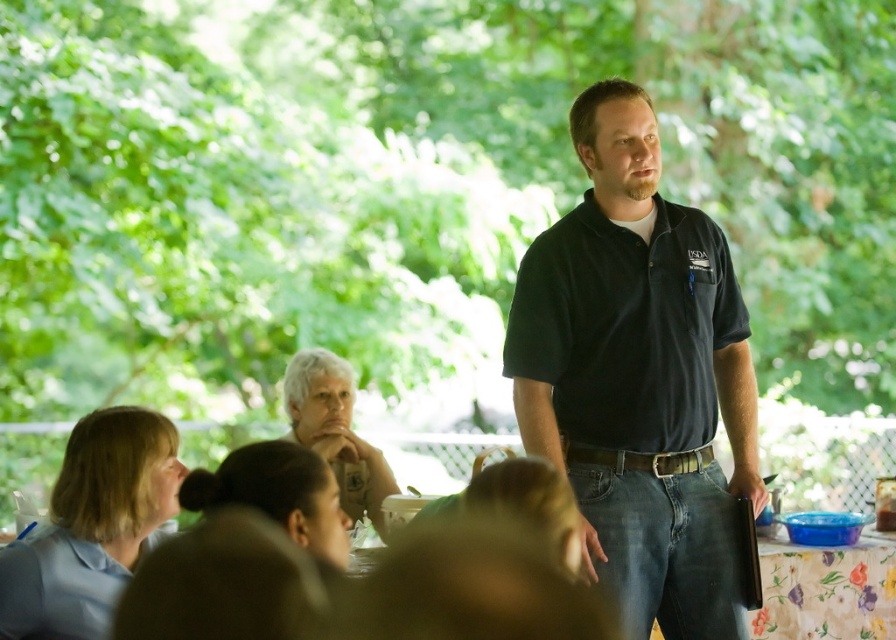
Question: Is dark blue shirt at center bigger than black cotton polo shirt at center?

Choices:
 (A) no
 (B) yes

Answer: (B)

Question: Where is dark blue shirt at center located in relation to black cotton polo shirt at center in the image?

Choices:
 (A) right
 (B) left

Answer: (A)

Question: Which point is closer to the camera taking this photo?

Choices:
 (A) (660, 602)
 (B) (515, 372)

Answer: (B)

Question: Based on their relative distances, which object is nearer to the black cotton polo shirt at center?

Choices:
 (A) floral fabric tablecloth at lower right
 (B) dark blue shirt at center

Answer: (B)

Question: Which of the following is the closest to the observer?

Choices:
 (A) floral fabric tablecloth at lower right
 (B) dark blue shirt at center
 (C) black cotton polo shirt at center

Answer: (B)

Question: Observing the image, what is the correct spatial positioning of dark blue shirt at center in reference to floral fabric tablecloth at lower right?

Choices:
 (A) left
 (B) right

Answer: (A)